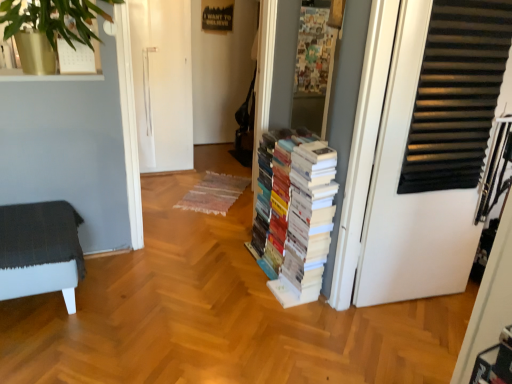
The height and width of the screenshot is (384, 512). I want to click on free spot to the right of dark gray fabric ottoman at left, so click(133, 301).